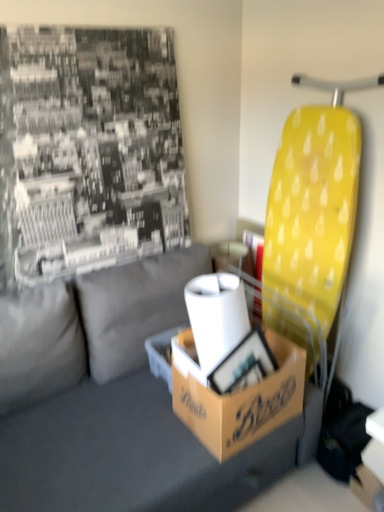
Measure the distance between gray fabric couch at center and camera.

1.27 meters.

The width and height of the screenshot is (384, 512). I want to click on gray fabric couch at center, so click(133, 414).

Could you tell me if white matte toilet paper at center is facing brown cardboard box at center?

No, white matte toilet paper at center is not facing towards brown cardboard box at center.

Based on the photo, which is behind, white matte toilet paper at center or brown cardboard box at center?

brown cardboard box at center.

From the image's perspective, which object appears higher, white matte toilet paper at center or brown cardboard box at center?

white matte toilet paper at center is shown above in the image.

Is gray fabric couch at center surrounded by brown cardboard box at center?

No.

Is point (175, 329) in front of point (84, 355)?

No.

Looking at their sizes, would you say brown cardboard box at center is wider or thinner than gray fabric couch at center?

In the image, brown cardboard box at center appears to be more narrow than gray fabric couch at center.

Is gray fabric couch at center to the left of brown cardboard box at center from the viewer's perspective?

Correct, you'll find gray fabric couch at center to the left of brown cardboard box at center.

Is gray fabric couch at center placed right next to brown cardboard box at center?

There is a gap between gray fabric couch at center and brown cardboard box at center.

From the image's perspective, between gray fabric couch at center and brown cardboard box at center, which one is located above?

brown cardboard box at center.

This screenshot has height=512, width=384. What are the coordinates of `studio couch below the brown cardboard box at center (from a real-world perspective)` in the screenshot? It's located at (133, 414).

Between gray fabric couch at center and brown cardboard box at center, which one has larger width?

gray fabric couch at center is wider.

Which of these two, gray fabric couch at center or brown cardboard box at center, stands taller?

gray fabric couch at center.

In the scene shown: Considering the positions of objects gray fabric couch at center and brown cardboard box at center in the image provided, who is more to the left, gray fabric couch at center or brown cardboard box at center?

From the viewer's perspective, gray fabric couch at center appears more on the left side.

Is brown cardboard box at center wider than brown cardboard box at center?

Indeed, brown cardboard box at center has a greater width compared to brown cardboard box at center.

Locate an element on the screen. The height and width of the screenshot is (512, 384). box in front of the brown cardboard box at center is located at coordinates (x=236, y=397).

Does brown cardboard box at center lie behind brown cardboard box at center?

No, brown cardboard box at center is closer to the camera.

Is brown cardboard box at center oriented away from brown cardboard box at center?

Yes.

Is brown cardboard box at center wider or thinner than brown cardboard box at center?

Clearly, brown cardboard box at center has less width compared to brown cardboard box at center.

From the image's perspective, which is above, brown cardboard box at center or brown cardboard box at center?

brown cardboard box at center is shown above in the image.

From a real-world perspective, relative to brown cardboard box at center, is brown cardboard box at center vertically above or below?

Clearly, from a real-world perspective, brown cardboard box at center is below brown cardboard box at center.

Can you confirm if brown cardboard box at center is positioned to the right of brown cardboard box at center?

Incorrect, brown cardboard box at center is not on the right side of brown cardboard box at center.

Which point is more forward, (218,448) or (64,457)?

The point (218,448) is more forward.

How far apart are brown cardboard box at center and gray fabric couch at center?

brown cardboard box at center and gray fabric couch at center are 9.19 inches apart.

Which of these two, brown cardboard box at center or gray fabric couch at center, stands taller?

gray fabric couch at center.

From a real-world perspective, which is physically above, brown cardboard box at center or gray fabric couch at center?

brown cardboard box at center is physically above.

The height and width of the screenshot is (512, 384). Find the location of `box below the white matte toilet paper at center (from the image's perspective)`. box below the white matte toilet paper at center (from the image's perspective) is located at coordinates (236, 397).

I want to click on cardboard box that is above the gray fabric couch at center (from the image's perspective), so click(x=161, y=354).

Based on their spatial positions, is white matte toilet paper at center or brown cardboard box at center further from gray fabric couch at center?

white matte toilet paper at center is further to gray fabric couch at center.

Which object lies nearer to the anchor point white matte toilet paper at center, brown cardboard box at center or brown cardboard box at center?

brown cardboard box at center lies closer to white matte toilet paper at center than the other object.

When comparing their distances from white matte toilet paper at center, does brown cardboard box at center or gray fabric couch at center seem further?

The object further to white matte toilet paper at center is gray fabric couch at center.

Estimate the real-world distances between objects in this image. Which object is further from gray fabric couch at center, brown cardboard box at center or white matte toilet paper at center?

The object further to gray fabric couch at center is white matte toilet paper at center.

When comparing their distances from white matte toilet paper at center, does brown cardboard box at center or gray fabric couch at center seem further?

Based on the image, gray fabric couch at center appears to be further to white matte toilet paper at center.

Estimate the real-world distances between objects in this image. Which object is closer to brown cardboard box at center, brown cardboard box at center or gray fabric couch at center?

gray fabric couch at center lies closer to brown cardboard box at center than the other object.

Considering their positions, is white matte toilet paper at center positioned further to brown cardboard box at center than gray fabric couch at center?

white matte toilet paper at center is further to brown cardboard box at center.

Looking at this image, looking at the image, which one is located closer to brown cardboard box at center, gray fabric couch at center or white matte toilet paper at center?

Based on the image, gray fabric couch at center appears to be nearer to brown cardboard box at center.

Locate an element on the screen. The height and width of the screenshot is (512, 384). toilet paper positioned between gray fabric couch at center and brown cardboard box at center from near to far is located at coordinates coord(216,316).

The width and height of the screenshot is (384, 512). Identify the location of box positioned between white matte toilet paper at center and brown cardboard box at center from near to far. (236, 397).

This screenshot has width=384, height=512. What are the coordinates of `toilet paper positioned between gray fabric couch at center and brown cardboard box at center from near to far` in the screenshot? It's located at (216, 316).

Image resolution: width=384 pixels, height=512 pixels. In order to click on box positioned between gray fabric couch at center and brown cardboard box at center from near to far in this screenshot , I will do `click(236, 397)`.